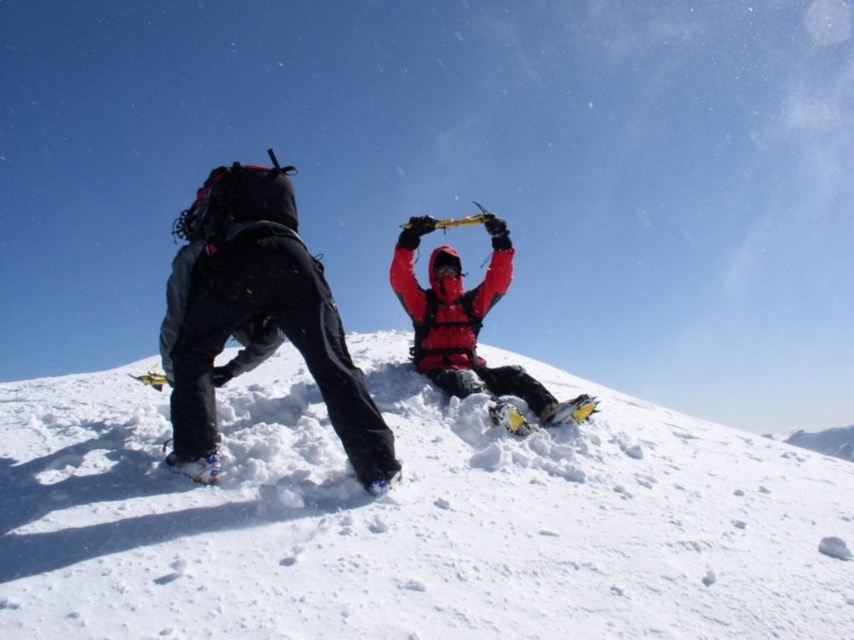
You are a mountain climber who needs to cross a section of snow. You are standing 5 meters away from the white fluffy snow at center. Can you step onto it without needing to move closer?

The white fluffy snow at center is 4.77 meters away from the viewer. Since you are 5 meters away, you cannot reach it without moving closer.

You are planning to take a photo of the snowy mountain scene. To ensure both the white fluffy snow at center and the matte black pants at left are clearly visible in the frame, where should you position the camera relative to the snow?

The matte black pants at left is behind the white fluffy snow at center, so positioning the camera behind the white fluffy snow at center would place the matte black pants at left in front, ensuring both are visible.